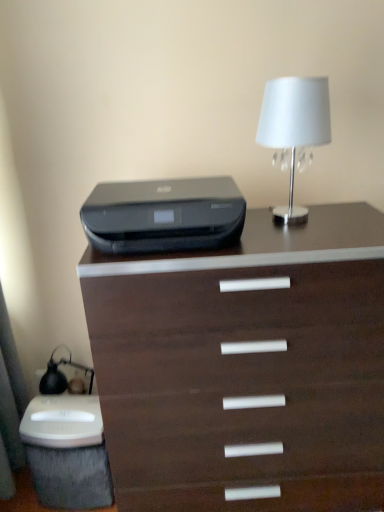
Question: Is black plastic printer at center taller or shorter than white fabric lampshade at upper right?

Choices:
 (A) short
 (B) tall

Answer: (A)

Question: Do you think black plastic printer at center is within white fabric lampshade at upper right, or outside of it?

Choices:
 (A) inside
 (B) outside

Answer: (B)

Question: Which is farther from the dark wood chest of drawers at center?

Choices:
 (A) black plastic printer at center
 (B) white fabric lampshade at upper right

Answer: (B)

Question: Which object is positioned farthest from the black plastic printer at center?

Choices:
 (A) dark wood chest of drawers at center
 (B) white fabric lampshade at upper right

Answer: (A)